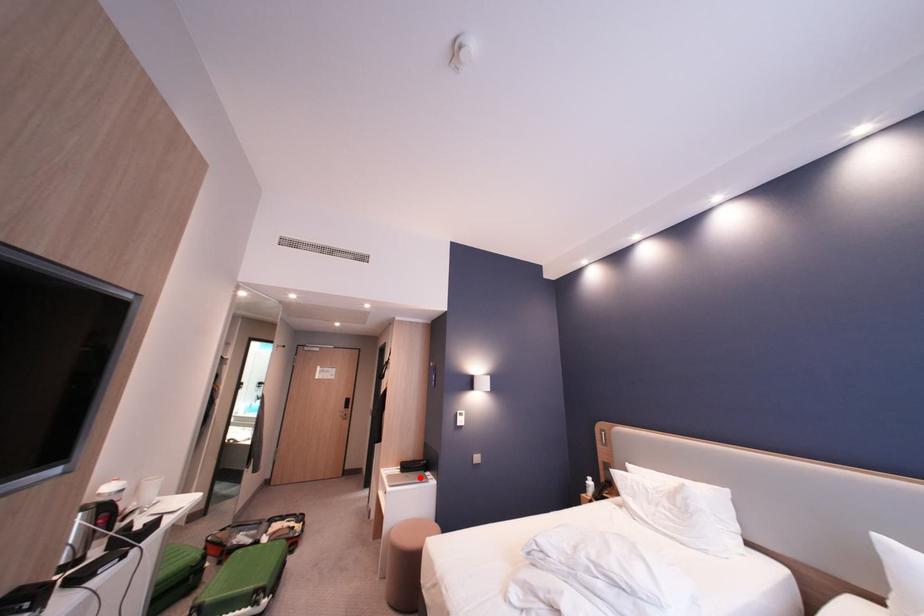
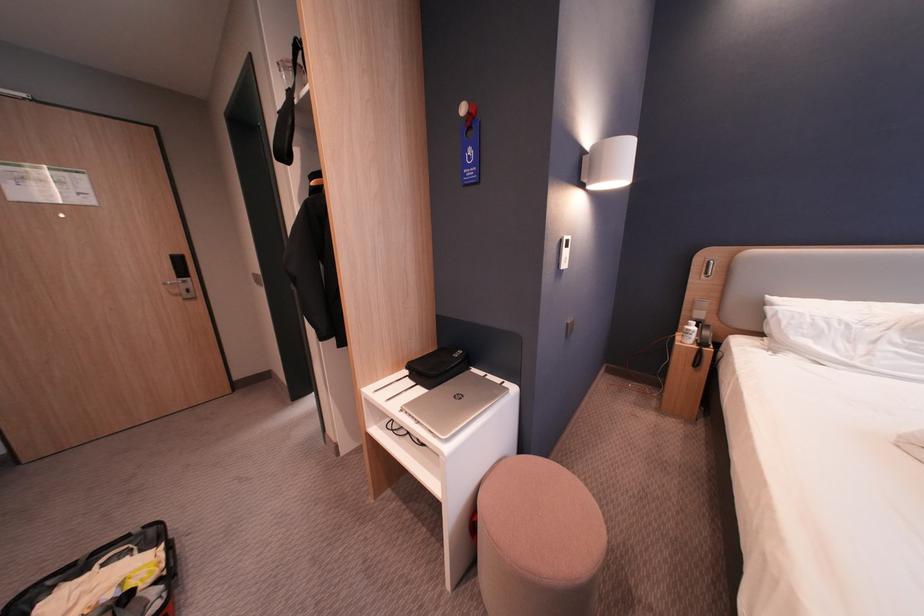
Question: I am providing you with two images of the same scene from different viewpoints. A red point is shown in image1. For the corresponding object point in image2, is it positioned nearer or farther from the camera?

Choices:
 (A) Nearer
 (B) Farther

Answer: (A)